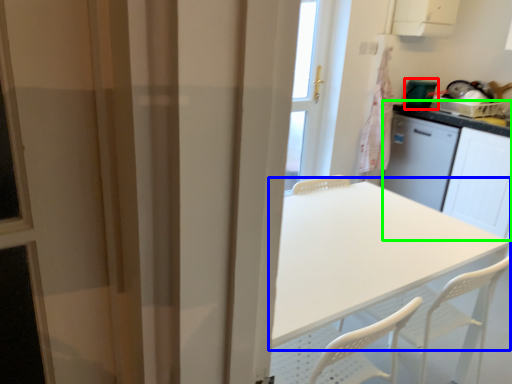
Question: Which is nearer to the appliance (highlighted by a red box)? table (highlighted by a blue box) or counter (highlighted by a green box).

Choices:
 (A) table
 (B) counter

Answer: (B)